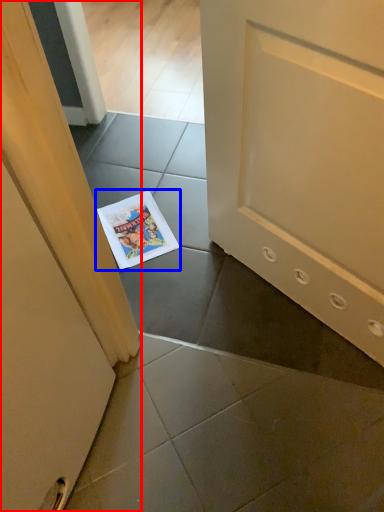
Question: Which object is further to the camera taking this photo, door (highlighted by a red box) or comic book (highlighted by a blue box)?

Choices:
 (A) door
 (B) comic book

Answer: (B)